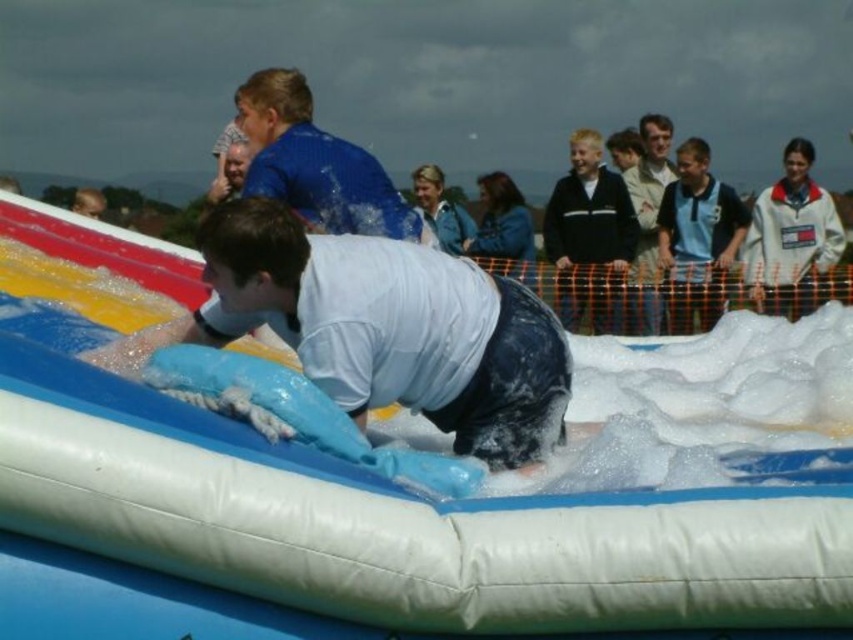
Measure the distance between white matte shirt at center and camera.

white matte shirt at center is 25.05 feet from camera.

Who is taller, white matte shirt at center or blue jersey at upper right?

white matte shirt at center is taller.

Between point (495, 394) and point (689, 156), which one is positioned in front?

Positioned in front is point (495, 394).

Find the location of `white matte shirt at center`. white matte shirt at center is located at coordinates (381, 328).

Does white matte shirt at center appear on the left side of light brown leather jacket at upper center?

Correct, you'll find white matte shirt at center to the left of light brown leather jacket at upper center.

This screenshot has height=640, width=853. I want to click on white matte shirt at center, so click(381, 328).

Consider the image. Is white matte shirt at center smaller than black fleece jacket at upper right?

No.

Between white matte shirt at center and black fleece jacket at upper right, which one is positioned lower?

white matte shirt at center

Is point (511, 448) positioned after point (610, 212)?

No.

This screenshot has width=853, height=640. I want to click on white matte shirt at center, so click(381, 328).